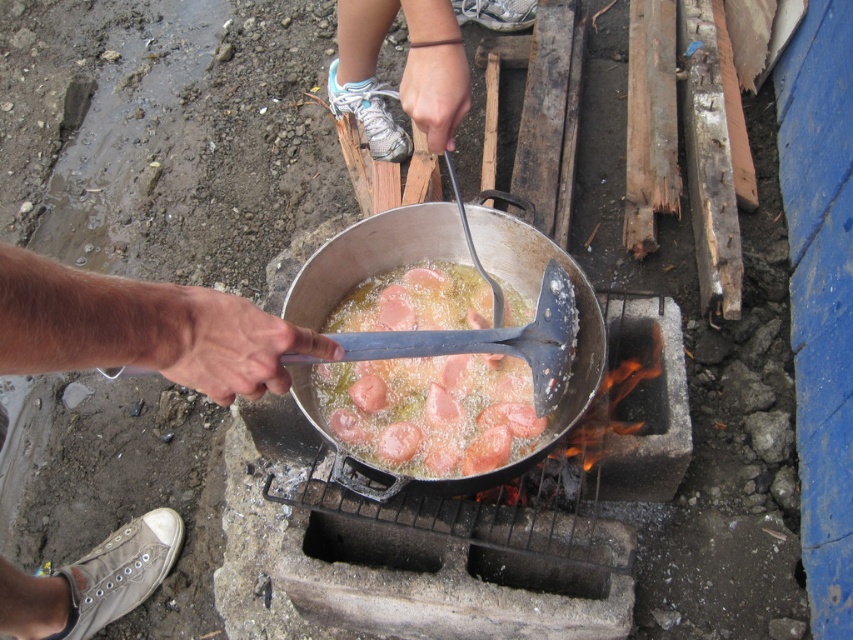
Is point (384, 422) positioned before point (355, 67)?

Yes, point (384, 422) is in front of point (355, 67).

Between pink glossy sausages at center and white fabric hand at upper center, which one appears on the right side from the viewer's perspective?

pink glossy sausages at center is more to the right.

Who is more forward, (453,396) or (445,84)?

Point (445,84) is in front.

Image resolution: width=853 pixels, height=640 pixels. I want to click on pink glossy sausages at center, so click(431, 410).

Between point (39, 262) and point (358, 10), which one is positioned in front?

Positioned in front is point (39, 262).

Who is more distant from viewer, [62,314] or [463,81]?

Positioned behind is point [463,81].

Identify the location of smooth skin hand at lower left. The width and height of the screenshot is (853, 640). (142, 328).

The width and height of the screenshot is (853, 640). What are the coordinates of `smooth skin hand at lower left` in the screenshot? It's located at (142, 328).

Does smooth skin hand at lower left appear on the left side of pink glossy sausages at center?

Yes, smooth skin hand at lower left is to the left of pink glossy sausages at center.

Can you confirm if smooth skin hand at lower left is bigger than pink glossy sausages at center?

Incorrect, smooth skin hand at lower left is not larger than pink glossy sausages at center.

Between point (152, 516) and point (399, 396), which one is positioned in front?

Point (399, 396) is in front.

Image resolution: width=853 pixels, height=640 pixels. In order to click on smooth skin hand at lower left in this screenshot , I will do `click(142, 328)`.